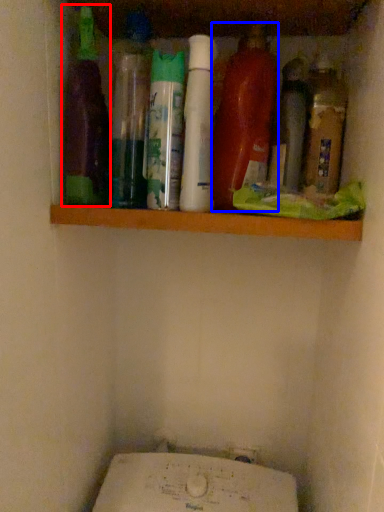
Question: Which object is closer to the camera taking this photo, bottle (highlighted by a red box) or bottle (highlighted by a blue box)?

Choices:
 (A) bottle
 (B) bottle

Answer: (A)